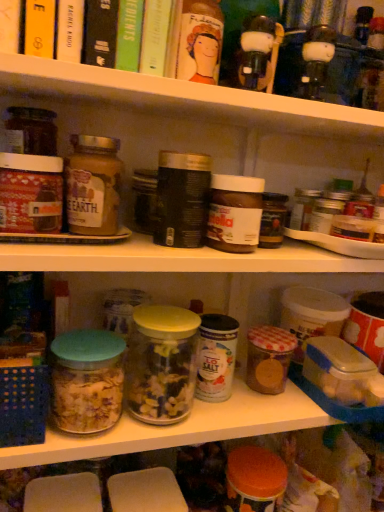
Question: Is matte glass jar at left, acting as the second cereal starting from the back, closer to camera compared to translucent glass jar of cereal at center, acting as the 1th cereal starting from the back?

Choices:
 (A) yes
 (B) no

Answer: (A)

Question: Does matte glass jar at left, the second cereal viewed from the right, have a greater height compared to translucent glass jar of cereal at center, which appears as the second cereal when viewed from the front?

Choices:
 (A) no
 (B) yes

Answer: (B)

Question: From a real-world perspective, is matte glass jar at left, acting as the 2th cereal starting from the bottom, physically below translucent glass jar of cereal at center, the 2th cereal when ordered from top to bottom?

Choices:
 (A) yes
 (B) no

Answer: (B)

Question: Can you confirm if matte glass jar at left, positioned as the 1th cereal in front-to-back order, is shorter than translucent glass jar of cereal at center, which ranks as the 1th cereal in bottom-to-top order?

Choices:
 (A) yes
 (B) no

Answer: (B)

Question: Is translucent glass jar of cereal at center, which appears as the second cereal when viewed from the front, inside matte glass jar at left, acting as the 2th cereal starting from the bottom?

Choices:
 (A) no
 (B) yes

Answer: (A)

Question: Are matte glass jar at left, acting as the second cereal starting from the back, and translucent glass jar of cereal at center, which is the 1th cereal from right to left, far apart?

Choices:
 (A) no
 (B) yes

Answer: (A)

Question: From the image's perspective, is hardcover book at upper left, the fourth book from the right, under green matte book at upper center, which appears as the third book when viewed from the left?

Choices:
 (A) no
 (B) yes

Answer: (A)

Question: From a real-world perspective, is hardcover book at upper left, the fourth book from the right, under green matte book at upper center, the second book when ordered from right to left?

Choices:
 (A) yes
 (B) no

Answer: (B)

Question: Is hardcover book at upper left, the fourth book from the right, closer to camera compared to green matte book at upper center, which appears as the third book when viewed from the left?

Choices:
 (A) yes
 (B) no

Answer: (A)

Question: Can you confirm if hardcover book at upper left, the fourth book from the right, is wider than green matte book at upper center, which appears as the third book when viewed from the left?

Choices:
 (A) yes
 (B) no

Answer: (B)

Question: Considering the relative sizes of hardcover book at upper left, the fourth book from the right, and green matte book at upper center, the second book when ordered from right to left, in the image provided, is hardcover book at upper left, the fourth book from the right, thinner than green matte book at upper center, the second book when ordered from right to left,?

Choices:
 (A) yes
 (B) no

Answer: (A)

Question: Considering the relative sizes of hardcover book at upper left, the 1th book when ordered from left to right, and green matte book at upper center, which appears as the third book when viewed from the left, in the image provided, is hardcover book at upper left, the 1th book when ordered from left to right, shorter than green matte book at upper center, which appears as the third book when viewed from the left,?

Choices:
 (A) yes
 (B) no

Answer: (A)

Question: Could you tell me if matte glass jar at left, acting as the second cereal starting from the back, is facing matte plastic jars at upper center, placed as the first shelf when sorted from top to bottom?

Choices:
 (A) yes
 (B) no

Answer: (B)